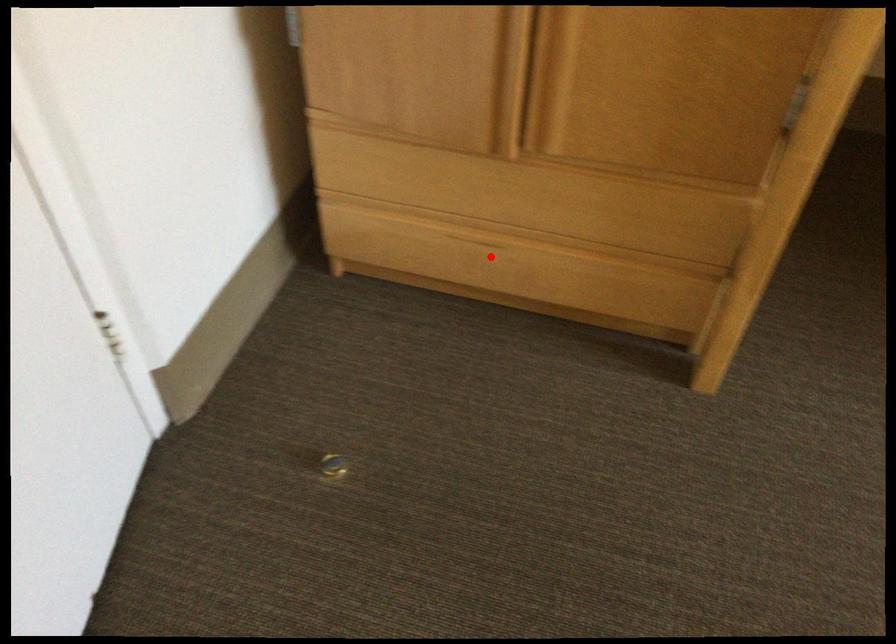
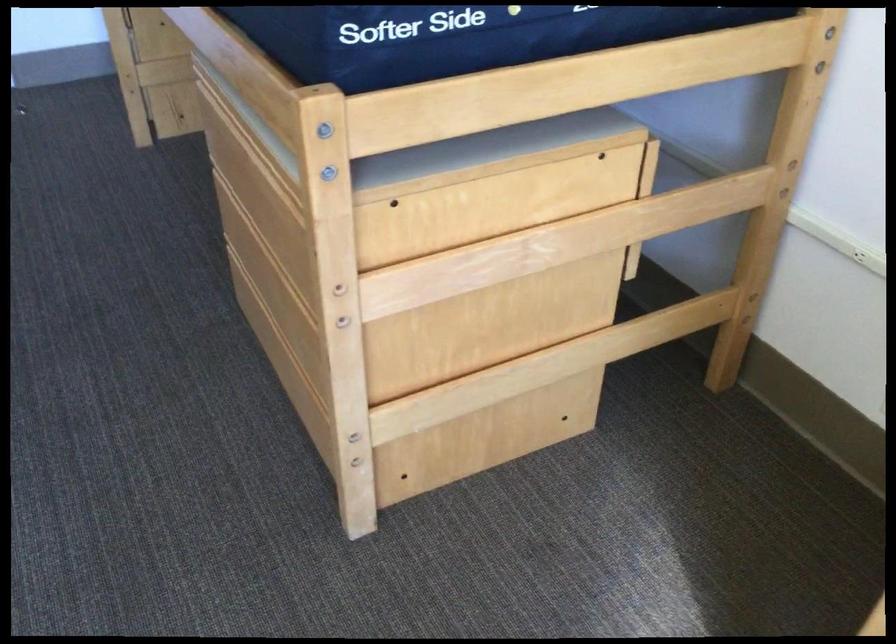
Question: I am providing you with two images of the same scene from different viewpoints. A red point is marked on the first image. Can you still see the location of the red point in image 2?

Choices:
 (A) Yes
 (B) No

Answer: (B)